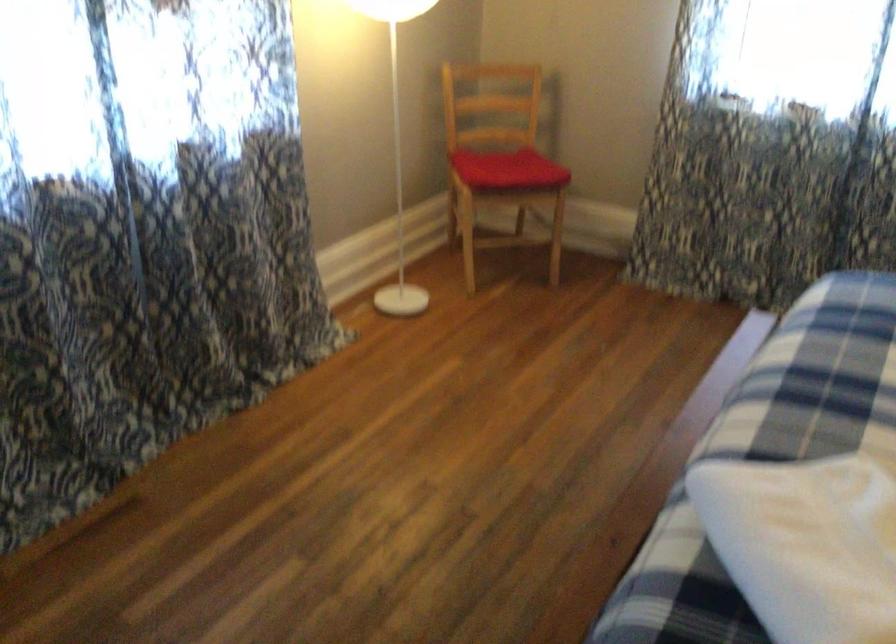
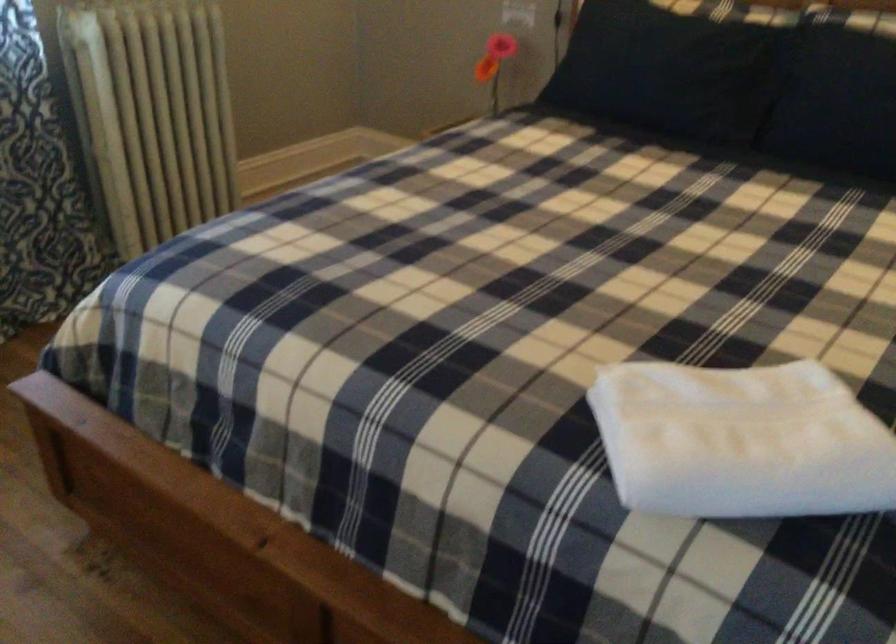
In the second image, find the point that corresponds to point (786, 565) in the first image.

(741, 440)